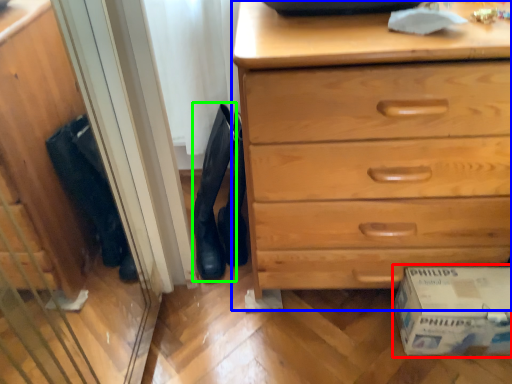
Question: Which object is positioned closest to cardboard box (highlighted by a red box)? Select from chest of drawers (highlighted by a blue box) and boot (highlighted by a green box).

Choices:
 (A) chest of drawers
 (B) boot

Answer: (A)